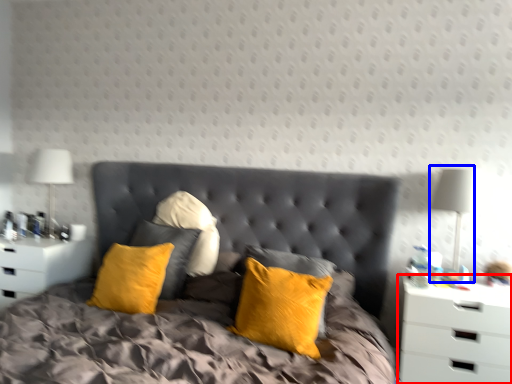
Question: Which point is closer to the camera, nightstand (highlighted by a red box) or bedside lamp (highlighted by a blue box)?

Choices:
 (A) nightstand
 (B) bedside lamp

Answer: (A)